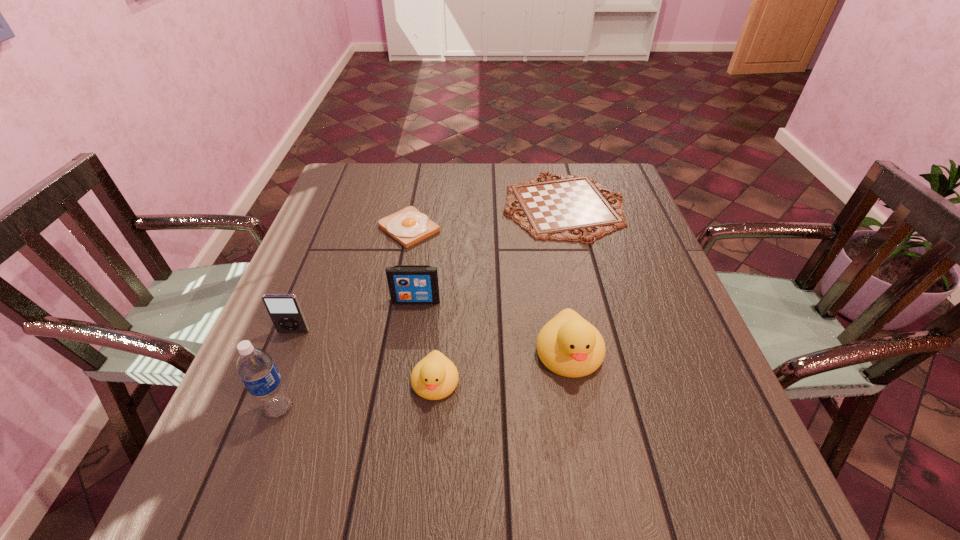
You are a GUI agent. You are given a task and a screenshot of the screen. Output one action in this format:
    pyautogui.click(x=<x>, y=<y>)
    Task: Click on the free space located on the face of the right duckling
    
    Given the screenshot: What is the action you would take?
    pyautogui.click(x=582, y=423)

Where is `vacant space situated 0.190m on the front screen of the farther iPod`? The width and height of the screenshot is (960, 540). vacant space situated 0.190m on the front screen of the farther iPod is located at coordinates (405, 375).

The width and height of the screenshot is (960, 540). I want to click on free point located on the left of the shortest object, so click(x=468, y=206).

Identify the location of vacant space located on the front of the toast. (382, 369).

What are the coordinates of `free space located 0.210m on the front-facing side of the left iPod` in the screenshot? It's located at (256, 424).

The image size is (960, 540). I want to click on free space located 0.110m on the back of the water bottle, so click(300, 349).

Where is `object present at the far edge`? This screenshot has width=960, height=540. object present at the far edge is located at coordinates (568, 208).

Identify the location of duckling present at the near edge. (435, 377).

The image size is (960, 540). I want to click on water bottle positioned at the near edge, so click(256, 368).

Identify the location of iPod located at the left edge. (284, 310).